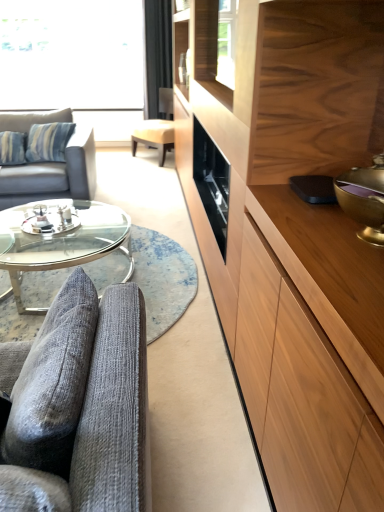
Question: In terms of width, does light brown wood drawer at right look wider or thinner when compared to transparent glass window at upper left?

Choices:
 (A) thin
 (B) wide

Answer: (A)

Question: In the image, is light brown wood drawer at right positioned in front of or behind transparent glass window at upper left?

Choices:
 (A) behind
 (B) front

Answer: (B)

Question: Considering the real-world distances, which object is closest to the black fabric curtain at upper center?

Choices:
 (A) transparent glass window at upper left
 (B) light brown leather swivel chair at center
 (C) clear glass coffee table at center
 (D) light brown wood drawer at right
 (E) wooden cabinet at right

Answer: (B)

Question: Which object is the closest to the light brown leather swivel chair at center?

Choices:
 (A) blue striped fabric couch at left, marked as the 1th studio couch in a left-to-right arrangement
 (B) clear glass coffee table at center
 (C) transparent glass coffee table at lower left
 (D) light brown wood drawer at right
 (E) textured gray couch at lower left, arranged as the 2th studio couch when viewed from the left

Answer: (A)